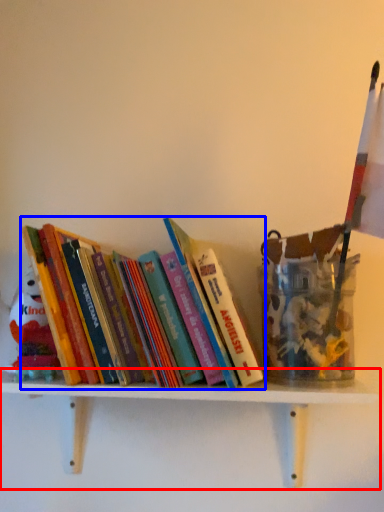
Question: Which object is closer to the camera taking this photo, shelf (highlighted by a red box) or book (highlighted by a blue box)?

Choices:
 (A) shelf
 (B) book

Answer: (A)